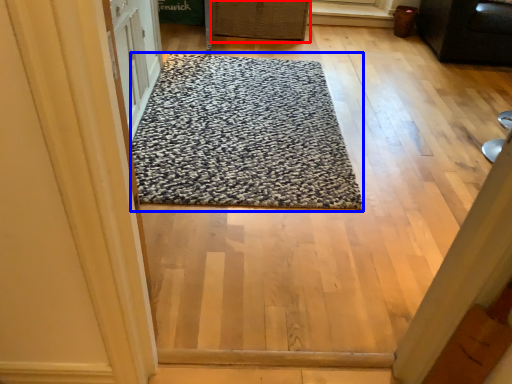
Question: Which object is further to the camera taking this photo, basket (highlighted by a red box) or mat (highlighted by a blue box)?

Choices:
 (A) basket
 (B) mat

Answer: (A)